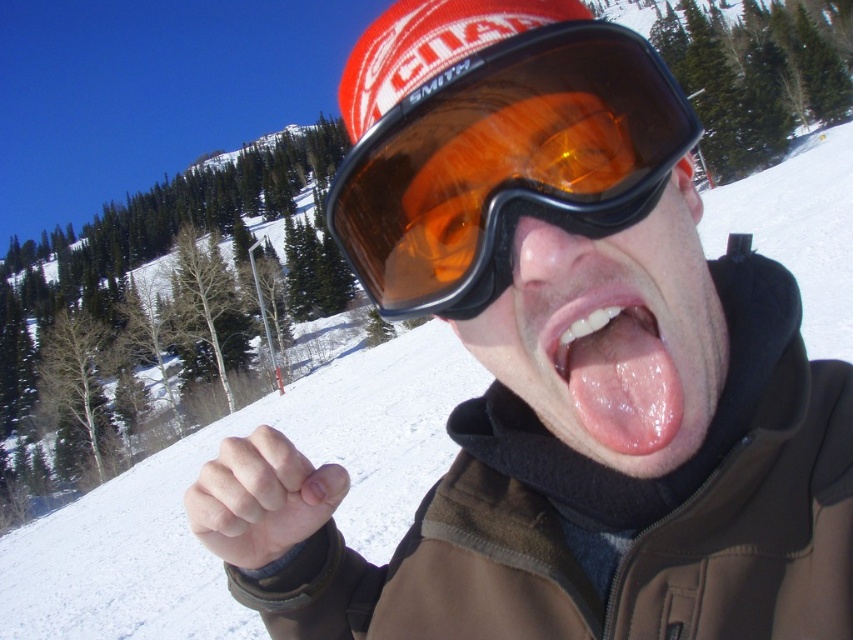
You are trying to determine which goggles are more prominent in the image. Both the orange tinted plastic goggles at center and the matte black goggles at center are present. Which of these two items is taller?

The orange tinted plastic goggles at center is much taller than the matte black goggles at center, so it is more prominent in terms of height.

You are a photographer capturing the scene. You notice the matte black goggles at center and the pink smooth tongue at center. Which object is closer to the camera lens?

The matte black goggles at center is closer to the camera lens because it is in front of the pink smooth tongue at center.